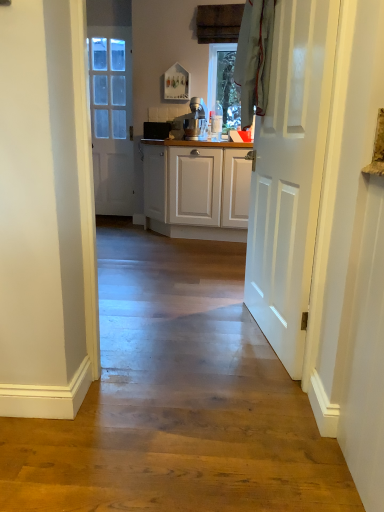
Question: Considering the positions of satin silver mixer at center, which ranks as the first appliance in right-to-left order, and white glossy door at center, the first door from the right, in the image, is satin silver mixer at center, which ranks as the first appliance in right-to-left order, bigger or smaller than white glossy door at center, the first door from the right,?

Choices:
 (A) big
 (B) small

Answer: (B)

Question: Is satin silver mixer at center, the 2th appliance from the back, wider or thinner than white glossy door at center, the first door from the right?

Choices:
 (A) thin
 (B) wide

Answer: (B)

Question: Which of these objects is positioned farthest from the white glossy door at center, which is the 2th door in left-to-right order?

Choices:
 (A) matte black toaster at center, positioned as the 2th appliance in front-to-back order
 (B) satin silver mixer at center, the 2th appliance from the back
 (C) white glossy door at left, positioned as the second door in right-to-left order

Answer: (C)

Question: Estimate the real-world distances between objects in this image. Which object is farther from the satin silver mixer at center, the 2th appliance from the back?

Choices:
 (A) white glossy door at left, the 1th door viewed from the back
 (B) white glossy door at center, acting as the 2th door starting from the back
 (C) matte black toaster at center, positioned as the 2th appliance in front-to-back order

Answer: (B)